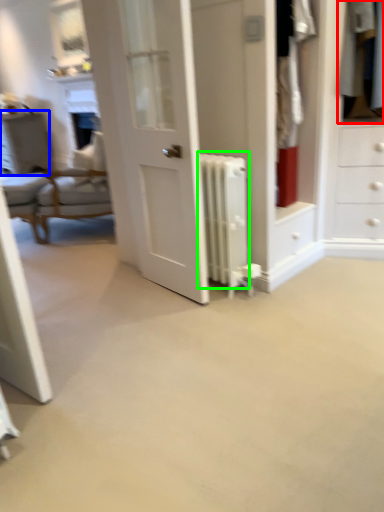
Question: Estimate the real-world distances between objects in this image. Which object is farther from clothing (highlighted by a red box), vanity (highlighted by a blue box) or radiator (highlighted by a green box)?

Choices:
 (A) vanity
 (B) radiator

Answer: (A)